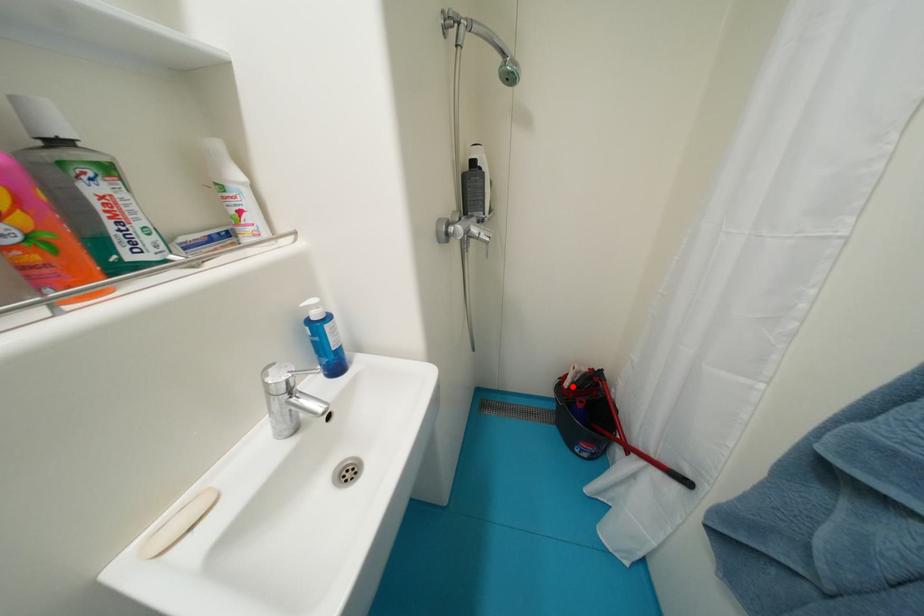
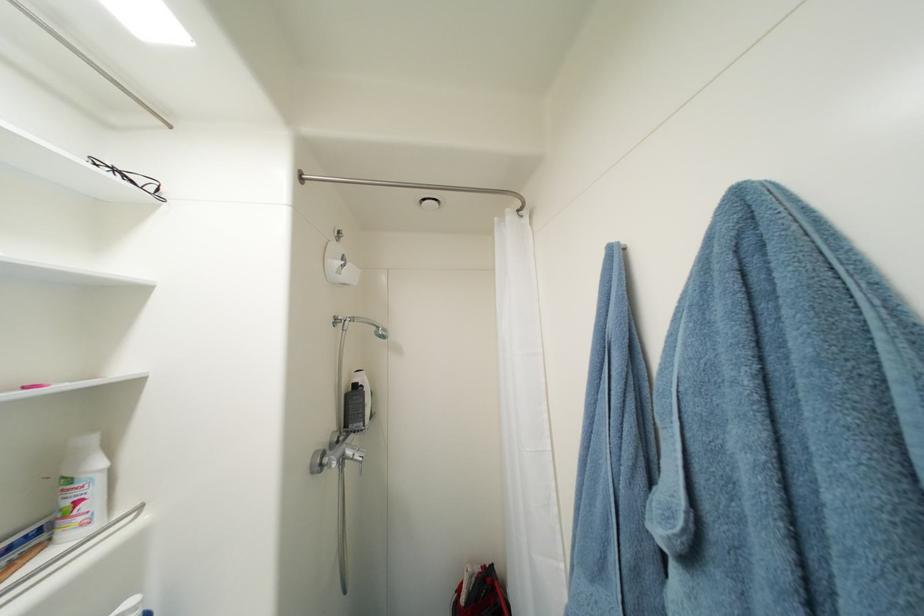
Where in the second image is the point corresponding to the highlighted location from the first image?

(469, 602)